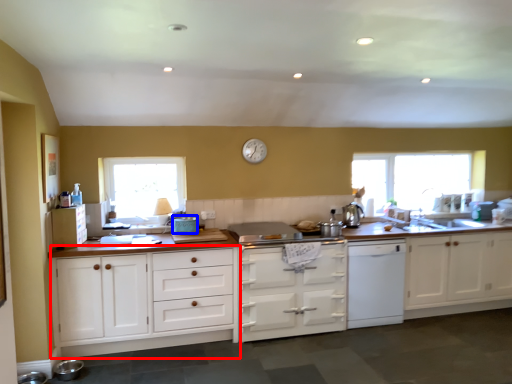
Question: Among these objects, which one is farthest to the camera, cabinetry (highlighted by a red box) or appliance (highlighted by a blue box)?

Choices:
 (A) cabinetry
 (B) appliance

Answer: (B)